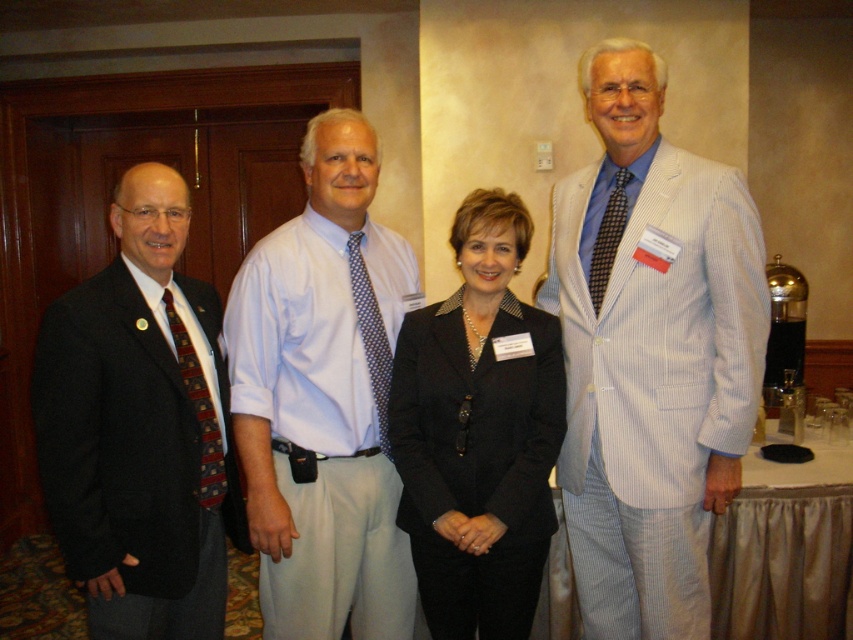
Question: Which object is farther from the camera taking this photo?

Choices:
 (A) white shirt at center
 (B) dark brown textured tie at right
 (C) black fabric suit at center
 (D) white striped suit at center

Answer: (B)

Question: Is white shirt at center to the right of black fabric suit at center from the viewer's perspective?

Choices:
 (A) no
 (B) yes

Answer: (A)

Question: Does white striped suit at center appear on the right side of dark gray suit at left?

Choices:
 (A) no
 (B) yes

Answer: (B)

Question: Which of the following is the farthest from the observer?

Choices:
 (A) (363, 262)
 (B) (753, 328)
 (C) (50, 420)
 (D) (206, 461)

Answer: (A)

Question: Which point is farther to the camera?

Choices:
 (A) red plaid tie at left
 (B) polka dot silk tie at center
 (C) dark gray suit at left
 (D) white striped suit at center

Answer: (B)

Question: Does white striped suit at center have a lesser width compared to polka dot silk tie at center?

Choices:
 (A) yes
 (B) no

Answer: (B)